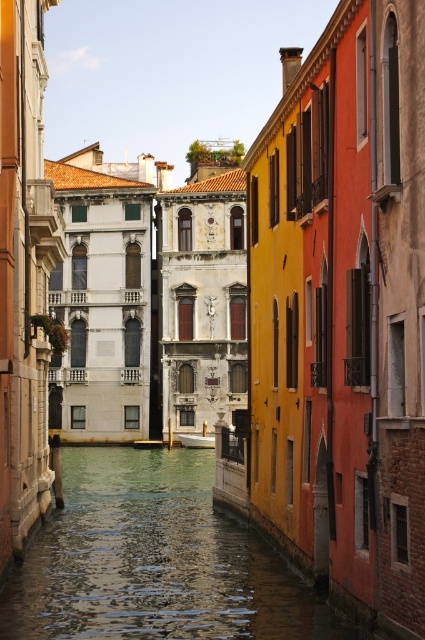
Question: Does greenish water at center lie behind white glossy boat at center?

Choices:
 (A) no
 (B) yes

Answer: (A)

Question: Does greenish water at center have a smaller size compared to white glossy boat at center?

Choices:
 (A) yes
 (B) no

Answer: (B)

Question: Can you confirm if greenish water at center is positioned below white glossy boat at center?

Choices:
 (A) yes
 (B) no

Answer: (A)

Question: Which of the following is the closest to the observer?

Choices:
 (A) (240, 579)
 (B) (214, 435)

Answer: (A)

Question: Which point is farther from the camera taking this photo?

Choices:
 (A) (206, 445)
 (B) (136, 556)

Answer: (A)